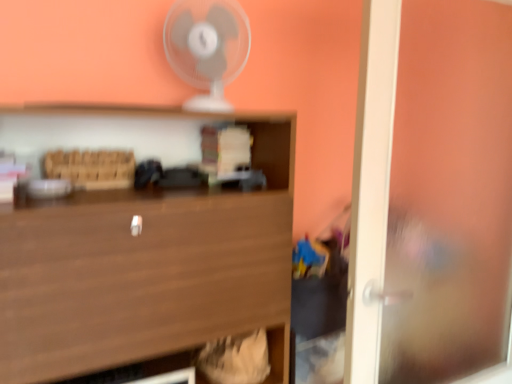
This screenshot has width=512, height=384. What do you see at coordinates (147, 264) in the screenshot? I see `wooden at center` at bounding box center [147, 264].

What do you see at coordinates (371, 186) in the screenshot?
I see `transparent glass door at right` at bounding box center [371, 186].

Locate an element on the screen. Image resolution: width=512 pixels, height=384 pixels. wooden at center is located at coordinates (147, 264).

Is white plastic fan at upper center in contact with transparent glass door at right?

No, white plastic fan at upper center is not beside transparent glass door at right.

Which of these two, white plastic fan at upper center or transparent glass door at right, stands shorter?

With less height is white plastic fan at upper center.

Looking at this image, from the image's perspective, is white plastic fan at upper center positioned above or below transparent glass door at right?

From the image's perspective, white plastic fan at upper center appears above transparent glass door at right.

Between white plastic fan at upper center and transparent glass door at right, which one has smaller size?

Smaller between the two is white plastic fan at upper center.

In terms of width, does white plastic fan at upper center look wider or thinner when compared to wooden at center?

Clearly, white plastic fan at upper center has less width compared to wooden at center.

Is white plastic fan at upper center with wooden at center?

white plastic fan at upper center is not next to wooden at center, and they're not touching.

Is white plastic fan at upper center shorter than wooden at center?

Yes.

Is wooden at center looking in the opposite direction of white plastic fan at upper center?

No.

Is wooden at center positioned behind white plastic fan at upper center?

No, the depth of wooden at center is less than that of white plastic fan at upper center.

Which is in front, point (138, 192) or point (213, 91)?

The point (138, 192) is closer to the camera.

Is wooden at center directly adjacent to white plastic fan at upper center?

wooden at center and white plastic fan at upper center are not in contact.

Is wooden at center far away from transparent glass door at right?

wooden at center is near transparent glass door at right, not far away.

Between wooden at center and transparent glass door at right, which one has larger width?

With larger width is wooden at center.

At what (x,y) coordinates should I click in order to perform the action: click on shelf lying on the left of transparent glass door at right. Please return your answer as a coordinate pair (x, y). Looking at the image, I should click on (147, 264).

Is transparent glass door at right facing away from wooden at center?

transparent glass door at right is not turned away from wooden at center.

Can you confirm if transparent glass door at right is wider than wooden at center?

Incorrect, the width of transparent glass door at right does not surpass that of wooden at center.

From a real-world perspective, is transparent glass door at right physically below wooden at center?

No, from a real-world perspective, transparent glass door at right is not below wooden at center.

Considering the relative positions of transparent glass door at right and wooden at center in the image provided, is transparent glass door at right to the left of wooden at center from the viewer's perspective?

No.

Considering the positions of points (350, 357) and (223, 35), is point (350, 357) farther from camera compared to point (223, 35)?

No.

From the image's perspective, which object appears higher, transparent glass door at right or white plastic fan at upper center?

white plastic fan at upper center is shown above in the image.

From a real-world perspective, is transparent glass door at right located beneath white plastic fan at upper center?

Yes.

Can you confirm if transparent glass door at right is wider than white plastic fan at upper center?

Incorrect, the width of transparent glass door at right does not surpass that of white plastic fan at upper center.

Where is `fan behind the transparent glass door at right`? This screenshot has height=384, width=512. fan behind the transparent glass door at right is located at coordinates pos(207,48).

You are a GUI agent. You are given a task and a screenshot of the screen. Output one action in this format:
    pyautogui.click(x=<x>, y=<y>)
    Task: Click on the shelf located on the left of white plastic fan at upper center
    
    Given the screenshot: What is the action you would take?
    pyautogui.click(x=147, y=264)

When comparing their distances from wooden at center, does transparent glass door at right or white plastic fan at upper center seem closer?

white plastic fan at upper center.

Based on their spatial positions, is wooden at center or white plastic fan at upper center closer to transparent glass door at right?

wooden at center.

When comparing their distances from white plastic fan at upper center, does wooden at center or transparent glass door at right seem further?

transparent glass door at right is further to white plastic fan at upper center.

Based on their spatial positions, is white plastic fan at upper center or transparent glass door at right further from wooden at center?

The object further to wooden at center is transparent glass door at right.

When comparing their distances from white plastic fan at upper center, does transparent glass door at right or wooden at center seem closer?

The object closer to white plastic fan at upper center is wooden at center.

Which object lies further to the anchor point transparent glass door at right, white plastic fan at upper center or wooden at center?

Based on the image, white plastic fan at upper center appears to be further to transparent glass door at right.

Identify the location of fan between wooden at center and transparent glass door at right in the horizontal direction. click(207, 48).